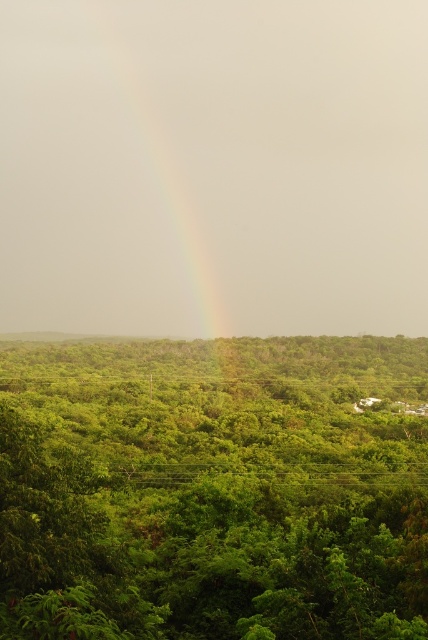
Question: Which point appears closest to the camera in this image?

Choices:
 (A) (363, 632)
 (B) (174, 49)

Answer: (A)

Question: Is green leafy tree at center below rainbow at center?

Choices:
 (A) no
 (B) yes

Answer: (B)

Question: Is green leafy tree at center above rainbow at center?

Choices:
 (A) yes
 (B) no

Answer: (B)

Question: Can you confirm if green leafy tree at center is smaller than rainbow at center?

Choices:
 (A) yes
 (B) no

Answer: (A)

Question: Among these objects, which one is nearest to the camera?

Choices:
 (A) green leafy tree at center
 (B) rainbow at center

Answer: (A)